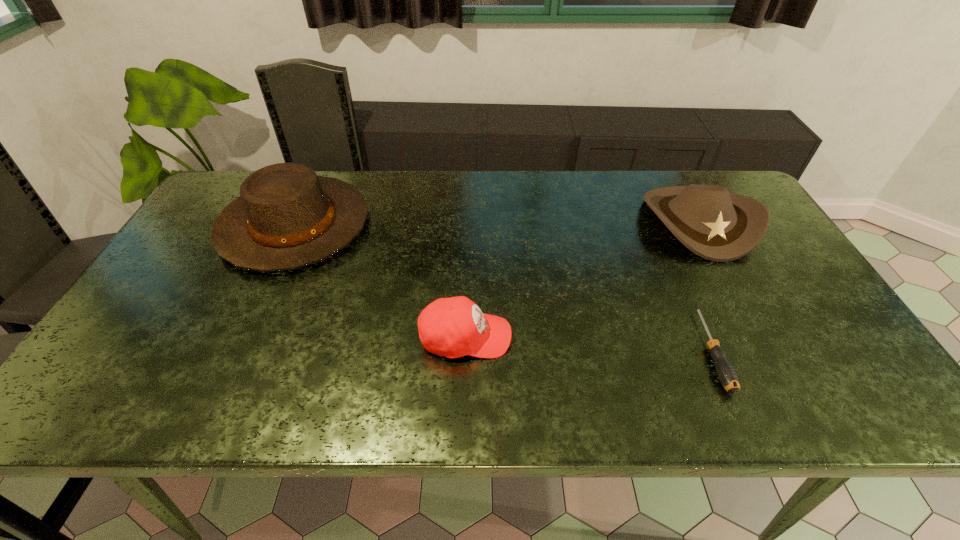
The image size is (960, 540). Identify the location of free spot between the tallest object and the baseball cap. (380, 281).

Find the location of a particular element. vacant area that lies between the shortest object and the right cowboy hat is located at coordinates (705, 285).

Where is `vacant space in between the tallest object and the third object from right to left`? vacant space in between the tallest object and the third object from right to left is located at coordinates (380, 281).

Where is `free spot between the baseball cap and the right cowboy hat`? Image resolution: width=960 pixels, height=540 pixels. free spot between the baseball cap and the right cowboy hat is located at coordinates (582, 279).

The width and height of the screenshot is (960, 540). Find the location of `vacant area between the baseball cap and the leftmost object`. vacant area between the baseball cap and the leftmost object is located at coordinates (380, 281).

Locate an element on the screen. Image resolution: width=960 pixels, height=540 pixels. empty location between the third shortest object and the shortest object is located at coordinates (705, 285).

Locate an element on the screen. Image resolution: width=960 pixels, height=540 pixels. vacant region between the second object from left to right and the leftmost object is located at coordinates (380, 281).

The width and height of the screenshot is (960, 540). Find the location of `free space that is in between the shorter cowboy hat and the screwdriver`. free space that is in between the shorter cowboy hat and the screwdriver is located at coordinates pos(705,285).

Locate an element on the screen. This screenshot has width=960, height=540. unoccupied area between the second tallest object and the tallest object is located at coordinates pyautogui.click(x=496, y=223).

The image size is (960, 540). I want to click on vacant region between the screwdriver and the left cowboy hat, so tap(503, 287).